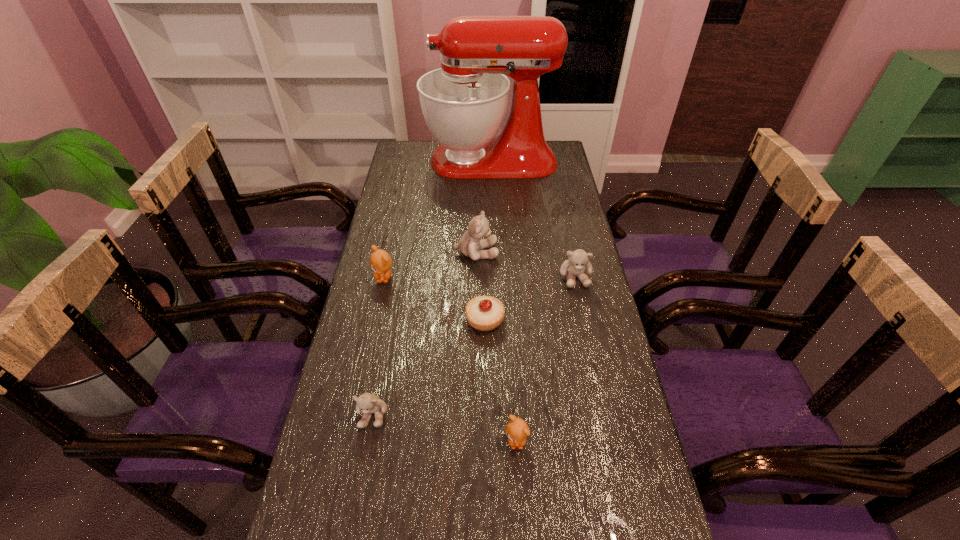
Identify which teddy bear is located as the second nearest to the fifth farthest object. Please provide its 2D coordinates. Your answer should be formatted as a tuple, i.e. [(x, y)], where the tuple contains the x and y coordinates of a point satisfying the conditions above.

[(578, 262)]

Identify which teddy bear is the fourth nearest to the leftmost gray teddy bear. Please provide its 2D coordinates. Your answer should be formatted as a tuple, i.e. [(x, y)], where the tuple contains the x and y coordinates of a point satisfying the conditions above.

[(578, 262)]

Locate which gray teddy bear ranks in proximity to the tallest teddy bear. Please provide its 2D coordinates. Your answer should be formatted as a tuple, i.e. [(x, y)], where the tuple contains the x and y coordinates of a point satisfying the conditions above.

[(578, 262)]

Select which gray teddy bear appears as the closest to the rightmost teddy bear. Please provide its 2D coordinates. Your answer should be formatted as a tuple, i.e. [(x, y)], where the tuple contains the x and y coordinates of a point satisfying the conditions above.

[(469, 244)]

The width and height of the screenshot is (960, 540). What are the coordinates of `vacant region that satisfies the following two spatial constraints: 1. on the face of the pastry; 2. on the right side of the biggest gray teddy bear` in the screenshot? It's located at (475, 320).

Where is `blank space that satisfies the following two spatial constraints: 1. on the face of the pastry; 2. on the left side of the bigger brown teddy bear`? Image resolution: width=960 pixels, height=540 pixels. blank space that satisfies the following two spatial constraints: 1. on the face of the pastry; 2. on the left side of the bigger brown teddy bear is located at coordinates (374, 320).